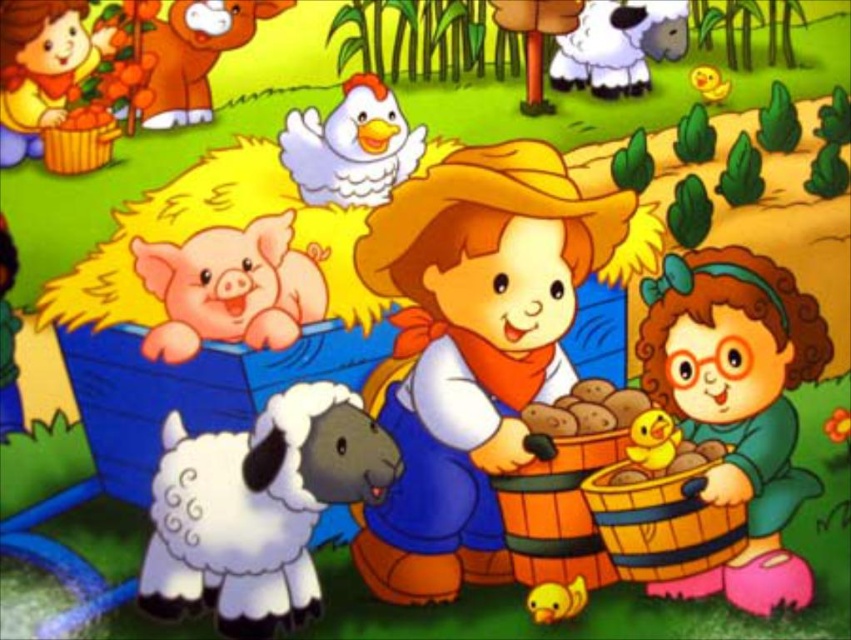
Question: Among these points, which one is nearest to the camera?

Choices:
 (A) (594, 92)
 (B) (307, 305)
 (C) (694, 356)
 (D) (290, 420)

Answer: (D)

Question: Which point is farther to the camera?

Choices:
 (A) click(x=666, y=45)
 (B) click(x=426, y=499)
 (C) click(x=306, y=561)
 (D) click(x=284, y=136)

Answer: (A)

Question: Does white fluffy chicken at upper center appear over white woolen sheep at upper center?

Choices:
 (A) no
 (B) yes

Answer: (A)

Question: Does green fabric dress at lower right appear on the left side of white fluffy chicken at upper center?

Choices:
 (A) yes
 (B) no

Answer: (B)

Question: Observing the image, what is the correct spatial positioning of green fabric dress at lower right in reference to white fluffy sheep at lower left?

Choices:
 (A) above
 (B) below

Answer: (A)

Question: Among these points, which one is nearest to the camera?

Choices:
 (A) (786, 481)
 (B) (280, 253)
 (C) (678, 26)
 (D) (141, 8)

Answer: (B)